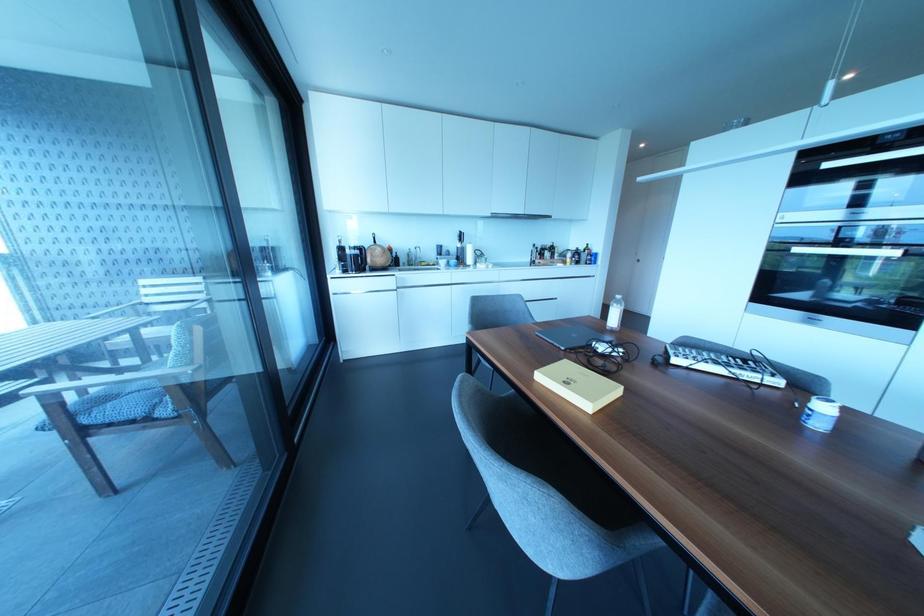
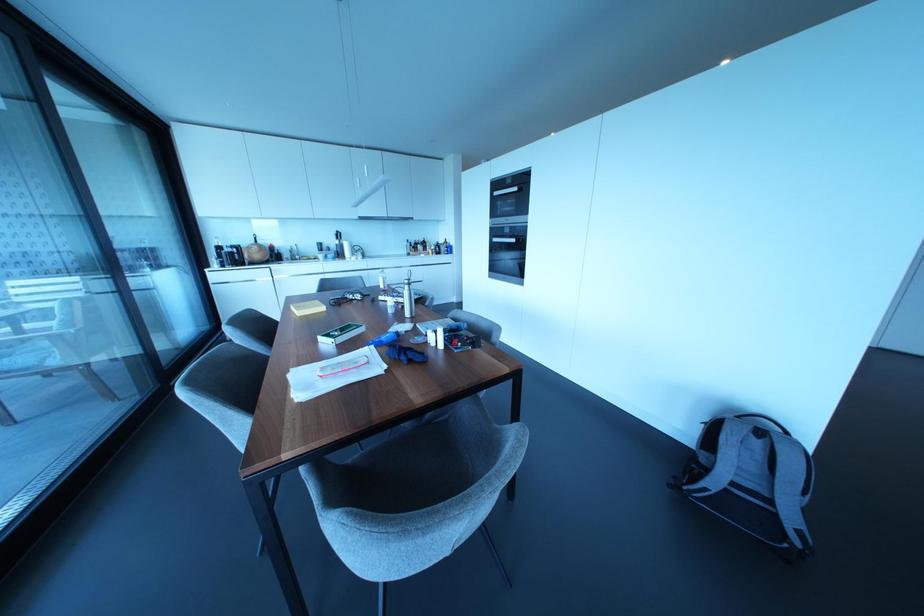
Find the pixel in the second image that matches point (796, 249) in the first image.

(493, 238)